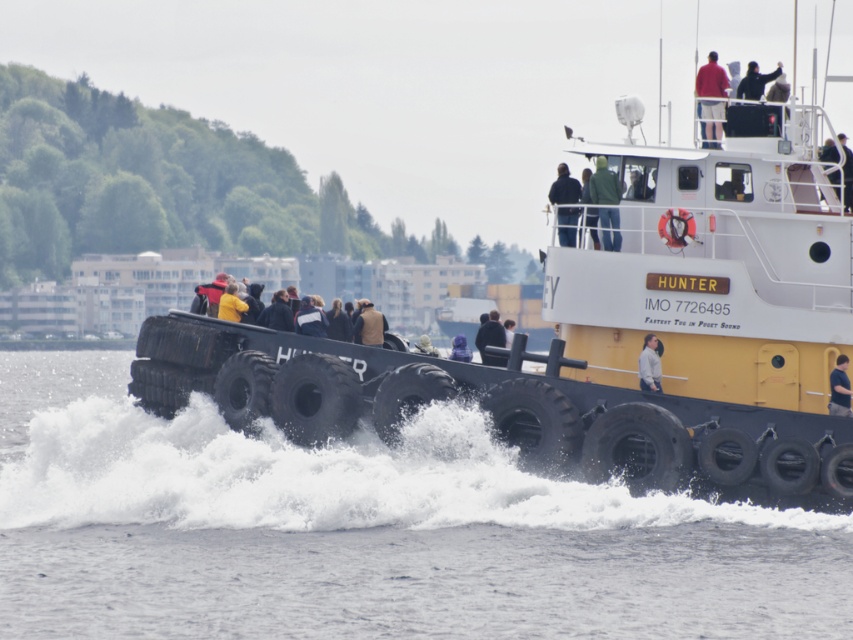
Is dark blue fabric jacket at upper right to the right of dark matte jacket at center from the viewer's perspective?

Indeed, dark blue fabric jacket at upper right is positioned on the right side of dark matte jacket at center.

Locate an element on the screen. The image size is (853, 640). dark blue fabric jacket at upper right is located at coordinates coord(840,164).

Where is `dark blue fabric jacket at upper right`? dark blue fabric jacket at upper right is located at coordinates (840, 164).

Can you confirm if dark blue jacket at upper center is taller than light gray fabric jacket at center?

Yes, dark blue jacket at upper center is taller than light gray fabric jacket at center.

Between point (558, 241) and point (643, 337), which one is positioned behind?

The point (558, 241) is more distant.

You are a GUI agent. You are given a task and a screenshot of the screen. Output one action in this format:
    pyautogui.click(x=<x>, y=<y>)
    Task: Click on the dark blue jacket at upper center
    The image size is (853, 640).
    Given the screenshot: What is the action you would take?
    pyautogui.click(x=564, y=188)

Which of these two, white frothy water at lower center or brown leather jacket at center, stands taller?

white frothy water at lower center is taller.

Who is higher up, white frothy water at lower center or brown leather jacket at center?

brown leather jacket at center is higher up.

Where is `white frothy water at lower center`? The width and height of the screenshot is (853, 640). white frothy water at lower center is located at coordinates (364, 531).

At what (x,y) coordinates should I click in order to perform the action: click on white frothy water at lower center. Please return your answer as a coordinate pair (x, y). The width and height of the screenshot is (853, 640). Looking at the image, I should click on (364, 531).